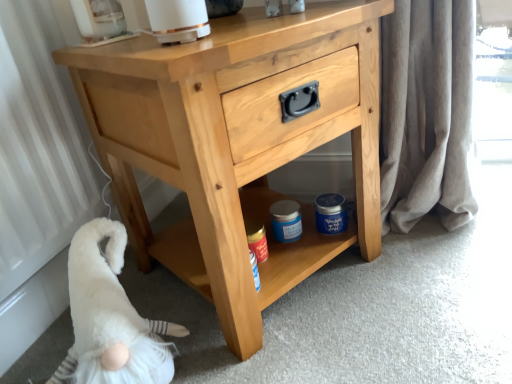
The image size is (512, 384). Find the location of `light wood chest of drawers at center`. light wood chest of drawers at center is located at coordinates (233, 144).

The height and width of the screenshot is (384, 512). Describe the element at coordinates (233, 144) in the screenshot. I see `light wood chest of drawers at center` at that location.

What is the approximate width of light wood chest of drawers at center?

light wood chest of drawers at center is 51.03 centimeters wide.

Identify the location of white fluffy gnome at lower left. This screenshot has width=512, height=384. click(x=110, y=317).

This screenshot has width=512, height=384. What do you see at coordinates (110, 317) in the screenshot? I see `white fluffy gnome at lower left` at bounding box center [110, 317].

Locate an element on the screen. light wood chest of drawers at center is located at coordinates (233, 144).

Considering the positions of objects light wood chest of drawers at center and white fluffy gnome at lower left in the image provided, who is more to the left, light wood chest of drawers at center or white fluffy gnome at lower left?

From the viewer's perspective, white fluffy gnome at lower left appears more on the left side.

Between light wood chest of drawers at center and white fluffy gnome at lower left, which one is positioned behind?

white fluffy gnome at lower left is further from the camera.

Which point is more forward, [362,4] or [113,372]?

Positioned in front is point [113,372].

From the image's perspective, is light wood chest of drawers at center under white fluffy gnome at lower left?

No, from the image's perspective, light wood chest of drawers at center is not below white fluffy gnome at lower left.

From a real-world perspective, is light wood chest of drawers at center located beneath white fluffy gnome at lower left?

No, from a real-world perspective, light wood chest of drawers at center is not under white fluffy gnome at lower left.

Considering the relative sizes of light wood chest of drawers at center and white fluffy gnome at lower left in the image provided, is light wood chest of drawers at center wider than white fluffy gnome at lower left?

Yes, light wood chest of drawers at center is wider than white fluffy gnome at lower left.

Which of these two, light wood chest of drawers at center or white fluffy gnome at lower left, stands shorter?

With less height is white fluffy gnome at lower left.

Can you confirm if light wood chest of drawers at center is bigger than white fluffy gnome at lower left?

Yes.

Is light wood chest of drawers at center located outside white fluffy gnome at lower left?

Yes, light wood chest of drawers at center is located beyond the bounds of white fluffy gnome at lower left.

Is light wood chest of drawers at center beside white fluffy gnome at lower left?

No, light wood chest of drawers at center is not next to white fluffy gnome at lower left.

Is light wood chest of drawers at center looking in the opposite direction of white fluffy gnome at lower left?

No, white fluffy gnome at lower left is not at the back of light wood chest of drawers at center.

Locate an element on the screen. This screenshot has width=512, height=384. animal to the left of light wood chest of drawers at center is located at coordinates (110, 317).

Can you confirm if white fluffy gnome at lower left is positioned to the left of light wood chest of drawers at center?

Correct, you'll find white fluffy gnome at lower left to the left of light wood chest of drawers at center.

Considering their positions, is white fluffy gnome at lower left located in front of or behind light wood chest of drawers at center?

Visually, white fluffy gnome at lower left is located behind light wood chest of drawers at center.

Which is closer, (124, 350) or (372, 139)?

Point (124, 350) is closer to the camera than point (372, 139).

From the image's perspective, is white fluffy gnome at lower left above or below light wood chest of drawers at center?

Clearly, from the image's perspective, white fluffy gnome at lower left is below light wood chest of drawers at center.

From a real-world perspective, does white fluffy gnome at lower left sit lower than light wood chest of drawers at center?

Yes, from a real-world perspective, white fluffy gnome at lower left is beneath light wood chest of drawers at center.

Is white fluffy gnome at lower left wider or thinner than light wood chest of drawers at center?

white fluffy gnome at lower left is thinner than light wood chest of drawers at center.

Can you confirm if white fluffy gnome at lower left is taller than light wood chest of drawers at center?

Incorrect, the height of white fluffy gnome at lower left is not larger of that of light wood chest of drawers at center.

Considering the sizes of objects white fluffy gnome at lower left and light wood chest of drawers at center in the image provided, who is bigger, white fluffy gnome at lower left or light wood chest of drawers at center?

With larger size is light wood chest of drawers at center.

Could light wood chest of drawers at center be considered to be inside white fluffy gnome at lower left?

No, light wood chest of drawers at center is located outside of white fluffy gnome at lower left.

Is white fluffy gnome at lower left with light wood chest of drawers at center?

No, white fluffy gnome at lower left is not touching light wood chest of drawers at center.

Is white fluffy gnome at lower left facing towards light wood chest of drawers at center?

No, white fluffy gnome at lower left is not aimed at light wood chest of drawers at center.

Measure the distance from white fluffy gnome at lower left to light wood chest of drawers at center.

white fluffy gnome at lower left and light wood chest of drawers at center are 11.66 inches apart.

Find the location of `animal below the light wood chest of drawers at center (from the image's perspective)`. animal below the light wood chest of drawers at center (from the image's perspective) is located at coordinates (110, 317).

In the image, there is a light wood chest of drawers at center. Where is `animal below it (from a real-world perspective)`? Image resolution: width=512 pixels, height=384 pixels. animal below it (from a real-world perspective) is located at coordinates (110, 317).

The image size is (512, 384). Identify the location of animal lying behind the light wood chest of drawers at center. (110, 317).